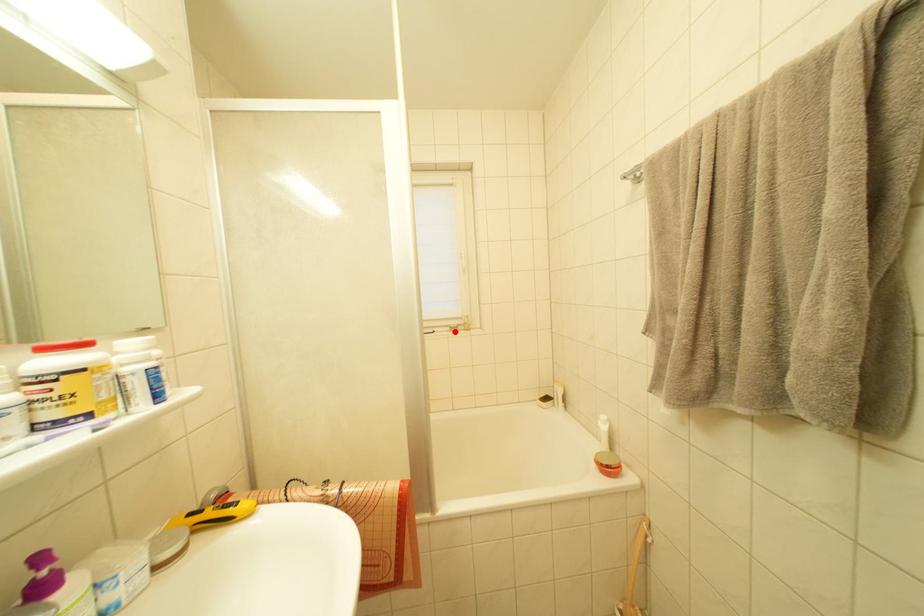
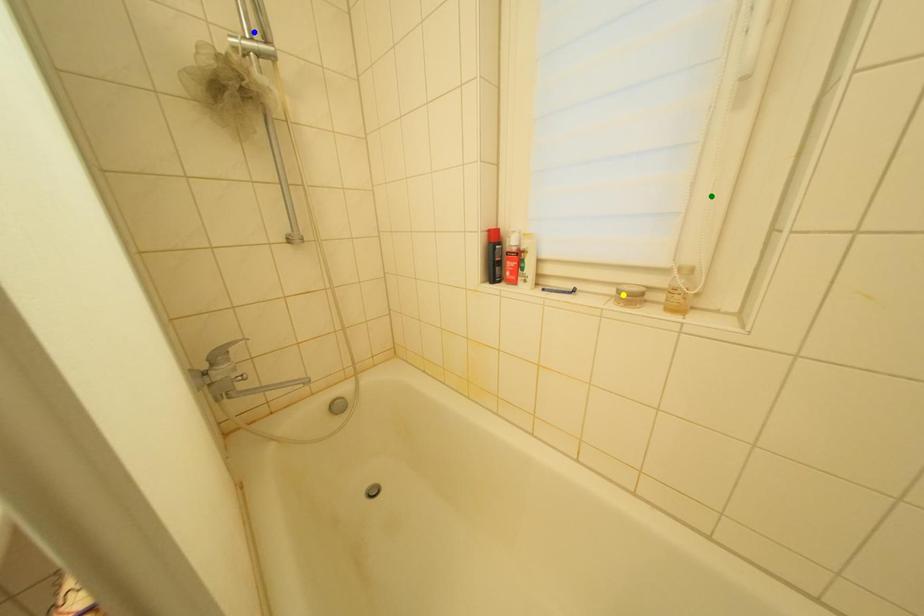
Question: I am providing you with two images of the same scene from different viewpoints. A red point is marked on the first image. You are given multiple points on the second image. In image 2, which mark is for the same physical point as the one in image 1?

Choices:
 (A) blue point
 (B) yellow point
 (C) green point

Answer: (B)